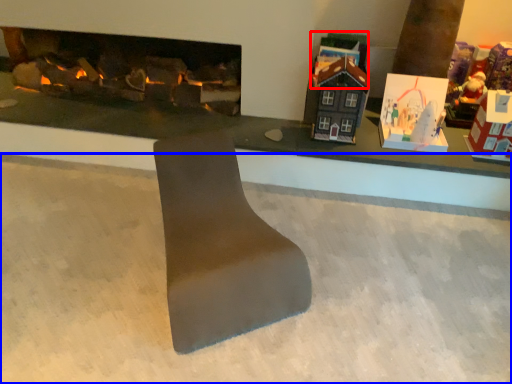
Question: Which object is closer to the camera taking this photo, toy (highlighted by a red box) or concrete (highlighted by a blue box)?

Choices:
 (A) toy
 (B) concrete

Answer: (B)